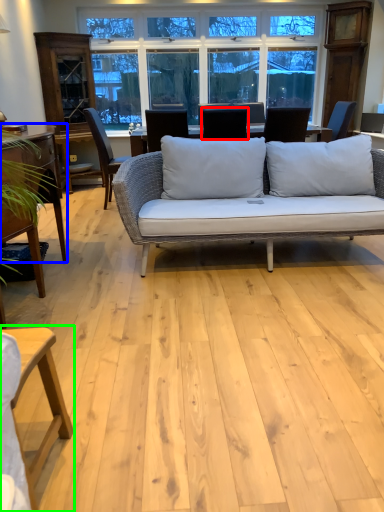
Question: Based on their relative distances, which object is nearer to chair (highlighted by a red box)? Choose from table (highlighted by a blue box) and table (highlighted by a green box).

Choices:
 (A) table
 (B) table

Answer: (A)